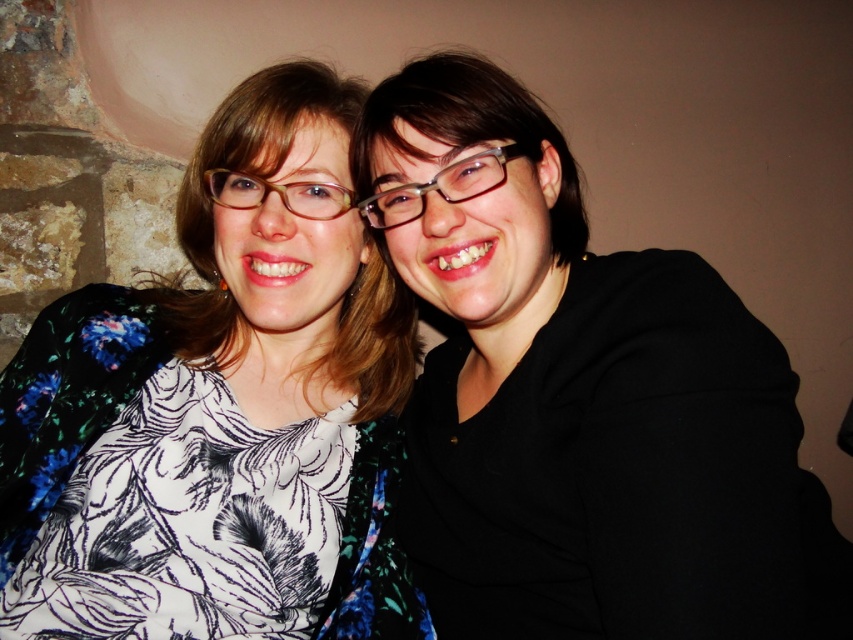
Which is in front, point (370, 148) or point (119, 458)?

Point (119, 458) is more forward.

Which of these two, black matte jacket at right or floral-patterned blouse at center, stands taller?

floral-patterned blouse at center is taller.

Is point (566, 205) positioned in front of point (325, 589)?

No.

At what (x,y) coordinates should I click in order to perform the action: click on black matte jacket at right. Please return your answer as a coordinate pair (x, y). Looking at the image, I should click on (581, 397).